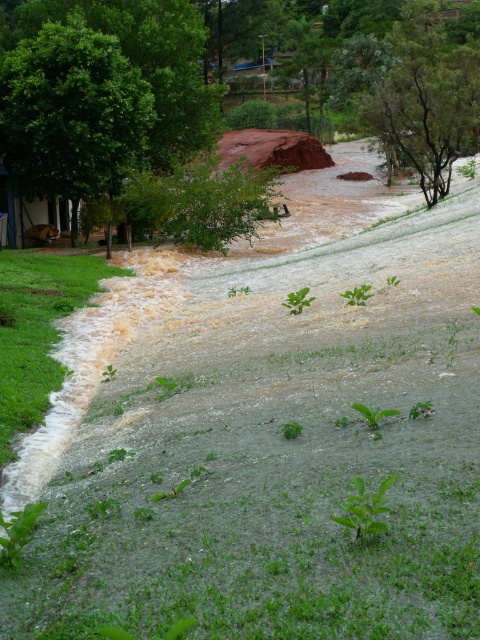
You are a rescue worker trying to navigate through the flooded area. You see a green leafy tree at upper left represented by point (71, 113). Based on the coordinates, can you determine if the tree is located in the upper half of the image?

The green leafy tree at upper left is represented by point (71, 113). Since the y coordinate is 0.148, which is less than 0.5, the tree is located in the upper half of the image.

You are a rescue worker assessing the flooded area. You see the green leafy tree at upper left and the green leafy tree at center. Which tree is taller?

The green leafy tree at upper left is taller than the green leafy tree at center.